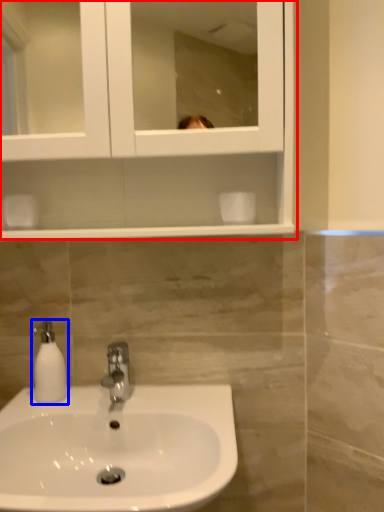
Question: Which of the following is the farthest to the observer, medicine cabinet (highlighted by a red box) or soap dispenser (highlighted by a blue box)?

Choices:
 (A) medicine cabinet
 (B) soap dispenser

Answer: (B)